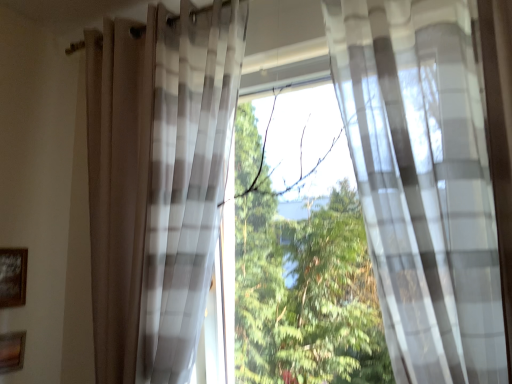
Question: From a real-world perspective, is wooden picture frame at lower left, the 1th picture frame in the bottom-to-top sequence, physically above translucent white curtain at center, the 1th curtain viewed from the right?

Choices:
 (A) no
 (B) yes

Answer: (A)

Question: Considering the relative sizes of wooden picture frame at lower left, the 1th picture frame in the bottom-to-top sequence, and translucent white curtain at center, the 1th curtain viewed from the right, in the image provided, is wooden picture frame at lower left, the 1th picture frame in the bottom-to-top sequence, taller than translucent white curtain at center, the 1th curtain viewed from the right,?

Choices:
 (A) no
 (B) yes

Answer: (A)

Question: Can you confirm if wooden picture frame at lower left, the 1th picture frame in the bottom-to-top sequence, is wider than translucent white curtain at center, arranged as the 2th curtain when viewed from the left?

Choices:
 (A) no
 (B) yes

Answer: (A)

Question: From a real-world perspective, is wooden picture frame at lower left, the 1th picture frame in the bottom-to-top sequence, under translucent white curtain at center, arranged as the 2th curtain when viewed from the left?

Choices:
 (A) no
 (B) yes

Answer: (B)

Question: Is wooden picture frame at lower left, the 1th picture frame in the bottom-to-top sequence, oriented towards translucent white curtain at center, the 1th curtain viewed from the right?

Choices:
 (A) yes
 (B) no

Answer: (B)

Question: Does point (179, 112) appear closer or farther from the camera than point (11, 254)?

Choices:
 (A) closer
 (B) farther

Answer: (A)

Question: Is translucent plaid curtain at center, which is the 1th curtain in left-to-right order, taller or shorter than wooden framed picture at lower left, which is the first picture frame from top to bottom?

Choices:
 (A) tall
 (B) short

Answer: (A)

Question: In the image, is translucent plaid curtain at center, which is the 1th curtain in left-to-right order, on the left side or the right side of wooden framed picture at lower left, which is the first picture frame from top to bottom?

Choices:
 (A) left
 (B) right

Answer: (B)

Question: Is translucent plaid curtain at center, which appears as the 2th curtain when viewed from the right, bigger or smaller than wooden framed picture at lower left, which is the first picture frame from top to bottom?

Choices:
 (A) small
 (B) big

Answer: (B)

Question: Relative to translucent white curtain at center, the 1th curtain viewed from the right, is wooden framed picture at lower left, which is the first picture frame from top to bottom, in front or behind?

Choices:
 (A) front
 (B) behind

Answer: (B)

Question: Considering the positions of point (2, 284) and point (498, 281), is point (2, 284) closer or farther from the camera than point (498, 281)?

Choices:
 (A) closer
 (B) farther

Answer: (B)

Question: Do you think wooden framed picture at lower left, the 2th picture frame ordered from the bottom, is within translucent white curtain at center, the 1th curtain viewed from the right, or outside of it?

Choices:
 (A) inside
 (B) outside

Answer: (B)

Question: From the image's perspective, is wooden framed picture at lower left, which is the first picture frame from top to bottom, positioned above or below translucent white curtain at center, the 1th curtain viewed from the right?

Choices:
 (A) below
 (B) above

Answer: (A)

Question: Is wooden picture frame at lower left, marked as the second picture frame in a top-to-bottom arrangement, to the left or to the right of wooden framed picture at lower left, which is the first picture frame from top to bottom, in the image?

Choices:
 (A) left
 (B) right

Answer: (B)

Question: Which is correct: wooden picture frame at lower left, the 1th picture frame in the bottom-to-top sequence, is inside wooden framed picture at lower left, which is the first picture frame from top to bottom, or outside of it?

Choices:
 (A) inside
 (B) outside

Answer: (B)